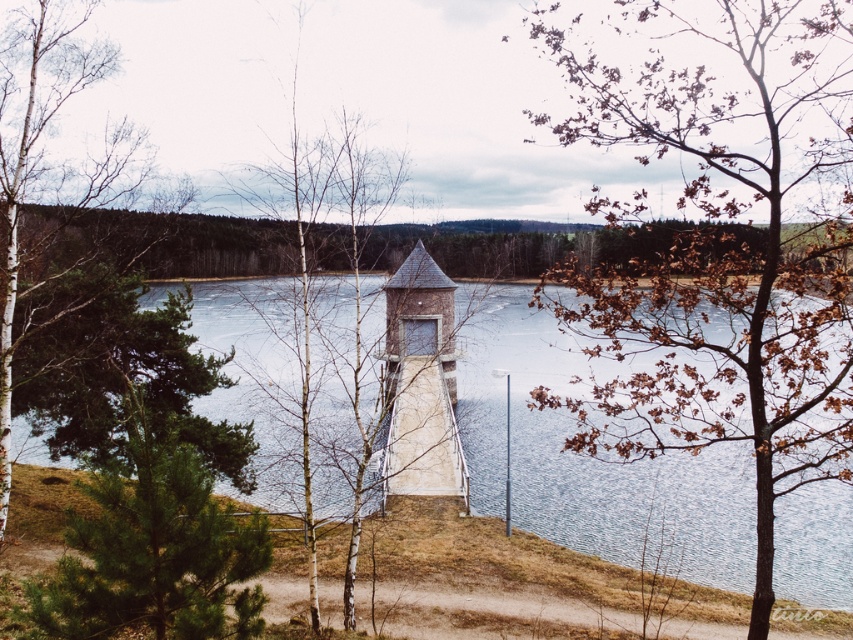
Question: Where is brown leafy tree at right located in relation to smooth concrete water at center in the image?

Choices:
 (A) left
 (B) right

Answer: (B)

Question: Where is brown leafy tree at right located in relation to green needle-like foliage at center-left in the image?

Choices:
 (A) below
 (B) above

Answer: (B)

Question: Does smooth concrete water at center have a greater width compared to green needle-like foliage at center-left?

Choices:
 (A) yes
 (B) no

Answer: (A)

Question: Which point is farther from the camera taking this photo?

Choices:
 (A) (67, 582)
 (B) (659, 451)

Answer: (B)

Question: Based on their relative distances, which object is farther from the smooth concrete water at center?

Choices:
 (A) green needle-like foliage at center-left
 (B) brown leafy tree at right

Answer: (A)

Question: Which of the following is the farthest from the observer?

Choices:
 (A) smooth concrete water at center
 (B) brown leafy tree at right

Answer: (A)